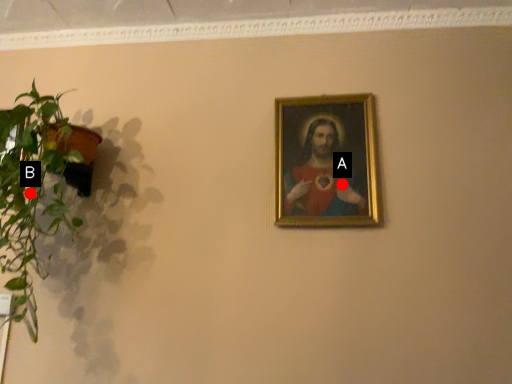
Question: Two points are circled on the image, labeled by A and B beside each circle. Which point appears farthest from the camera in this image?

Choices:
 (A) A is further
 (B) B is further

Answer: (A)